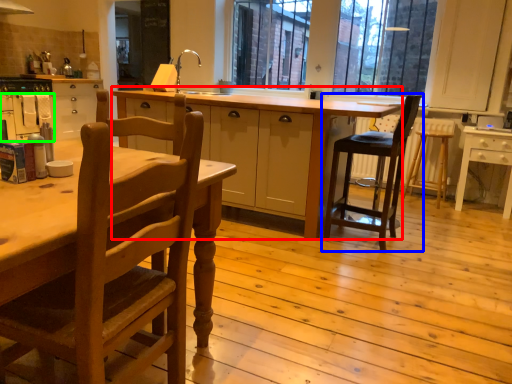
Question: Estimate the real-world distances between objects in this image. Which object is farther from table (highlighted by a red box), chair (highlighted by a blue box) or oven (highlighted by a green box)?

Choices:
 (A) chair
 (B) oven

Answer: (B)